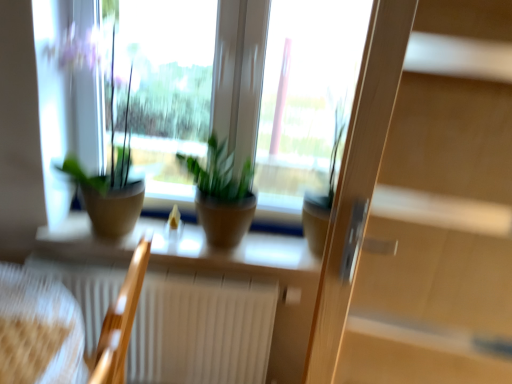
The width and height of the screenshot is (512, 384). In order to click on vacant space underneath green matte plant at center, marked as the second houseplant in a right-to-left arrangement (from a real-world perspective) in this screenshot , I will do `click(202, 243)`.